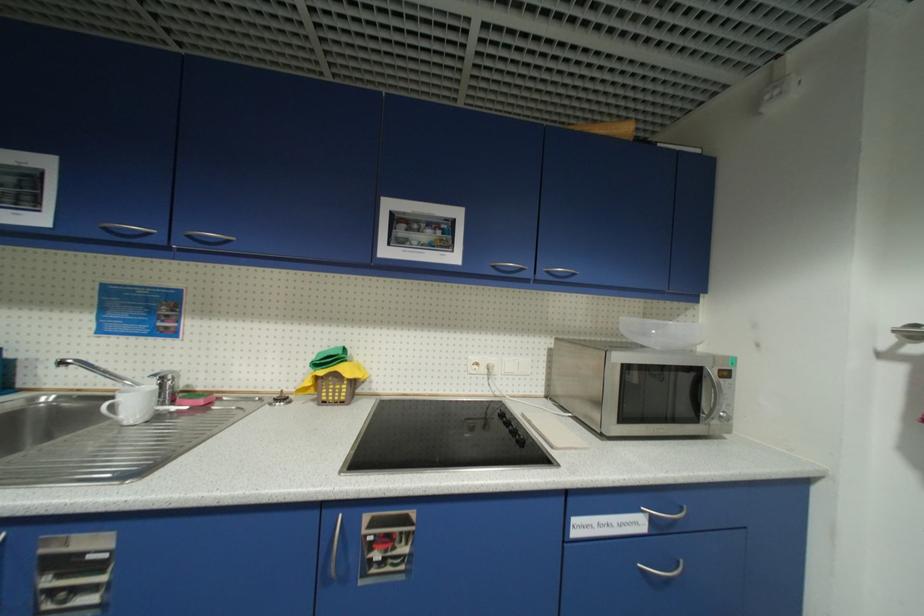
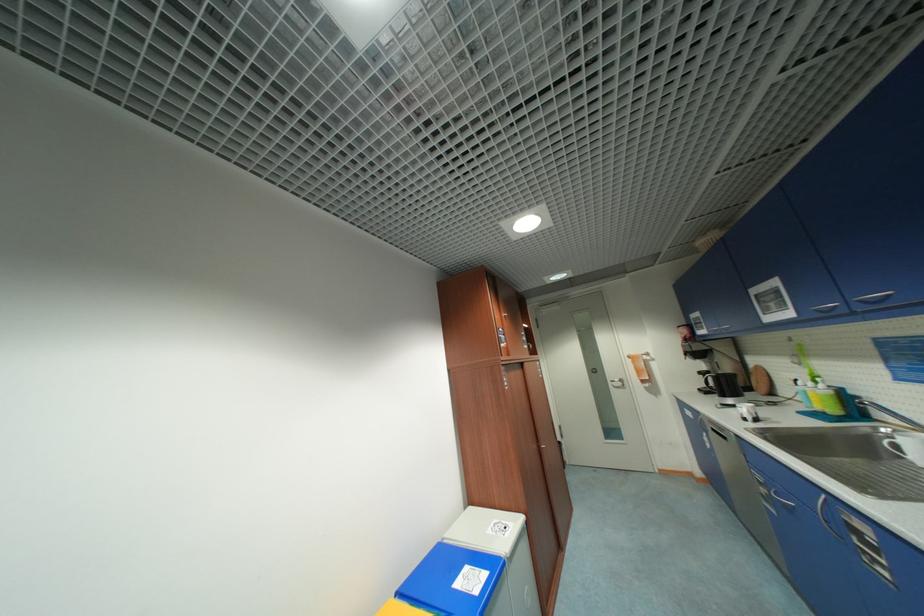
Find the pixel in the second image that matches point (112, 230) in the first image.

(822, 312)